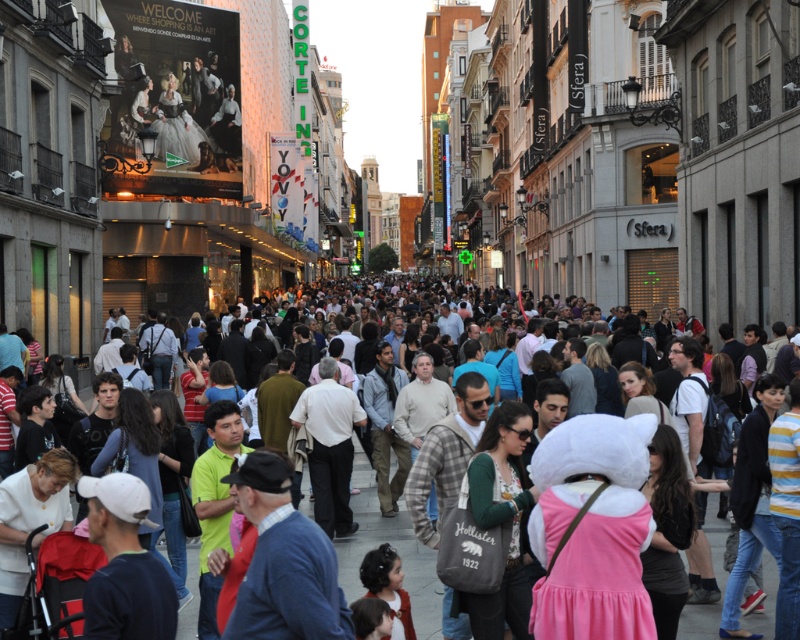
Question: Is pink fabric costume at center bigger than dark hair at center?

Choices:
 (A) no
 (B) yes

Answer: (A)

Question: Among these objects, which one is farthest from the camera?

Choices:
 (A) striped knit sweater at lower right
 (B) dark green cotton sweater at center
 (C) light blue shirt at center
 (D) dark hair at center

Answer: (C)

Question: Is striped knit sweater at lower right above white cotton shirt at lower left?

Choices:
 (A) no
 (B) yes

Answer: (A)

Question: Based on their relative distances, which object is farther from the light blue shirt at center?

Choices:
 (A) white cotton shirt at center
 (B) striped knit sweater at lower right

Answer: (B)

Question: Which point is closer to the camera?

Choices:
 (A) multicolored casual attire at center
 (B) dark hair at center

Answer: (B)

Question: Can you confirm if striped knit sweater at lower right is wider than white cotton shirt at center?

Choices:
 (A) yes
 (B) no

Answer: (A)